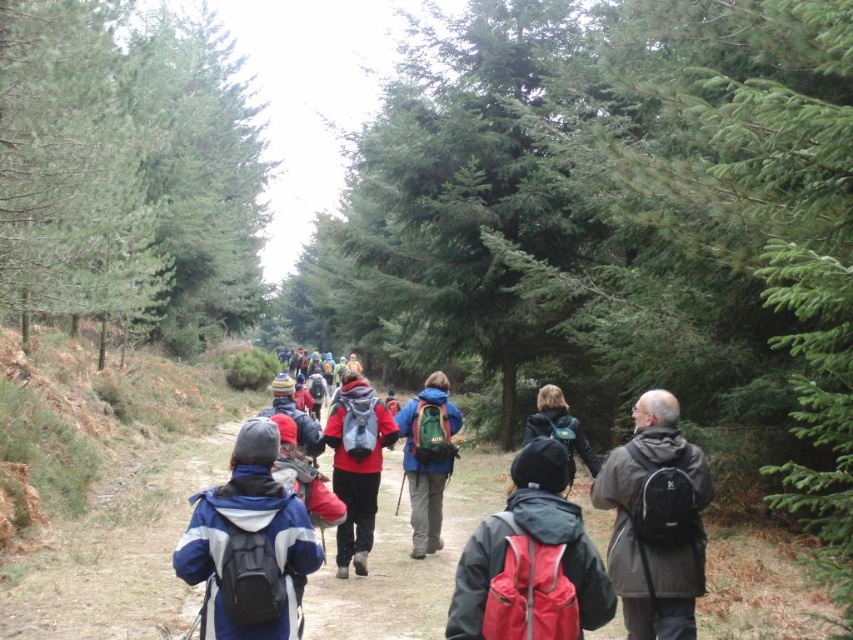
Who is more distant from viewer, (172,193) or (582,451)?

Point (172,193)

In order to click on green matte tree at left in this screenshot , I will do `click(129, 170)`.

Does point (74, 97) come farther from viewer compared to point (473, 579)?

That is True.

Describe the element at coordinates (129, 170) in the screenshot. Image resolution: width=853 pixels, height=640 pixels. I see `green matte tree at left` at that location.

Is point (6, 157) positioned before point (485, 536)?

No, it is not.

Locate an element on the screen. green matte tree at left is located at coordinates (129, 170).

Is the position of red backpack at center more distant than that of matte black backpack at center?

No, red backpack at center is closer to the viewer.

Who is more forward, (593, 612) or (577, 444)?

Positioned in front is point (593, 612).

Between point (558, 554) and point (572, 428), which one is positioned behind?

Positioned behind is point (572, 428).

This screenshot has width=853, height=640. I want to click on red backpack at center, so (531, 561).